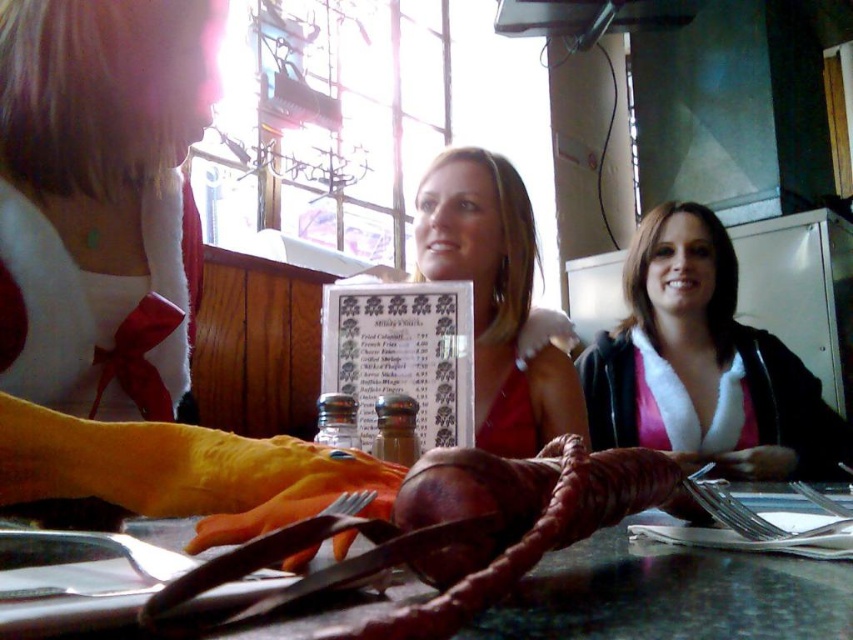
Can you confirm if shiny metallic table at center is positioned below matte red dress at center?

Correct, shiny metallic table at center is located below matte red dress at center.

Between shiny metallic table at center and matte red dress at center, which one is positioned higher?

Positioned higher is matte red dress at center.

Is point (724, 563) positioned behind point (486, 440)?

No.

Image resolution: width=853 pixels, height=640 pixels. What are the coordinates of `shiny metallic table at center` in the screenshot? It's located at (671, 595).

Who is lower down, white plush doll at upper left or pink fleece-lined jacket at center?

pink fleece-lined jacket at center is below.

Who is taller, white plush doll at upper left or pink fleece-lined jacket at center?

pink fleece-lined jacket at center is taller.

This screenshot has height=640, width=853. I want to click on white plush doll at upper left, so click(122, 272).

Consider the image. Can you confirm if pink fleece-lined jacket at center is shorter than white paper menu at center?

In fact, pink fleece-lined jacket at center may be taller than white paper menu at center.

Does pink fleece-lined jacket at center have a greater width compared to white paper menu at center?

Yes, pink fleece-lined jacket at center is wider than white paper menu at center.

Is point (718, 417) in front of point (454, 304)?

No.

Identify the location of pink fleece-lined jacket at center. The width and height of the screenshot is (853, 640). (703, 364).